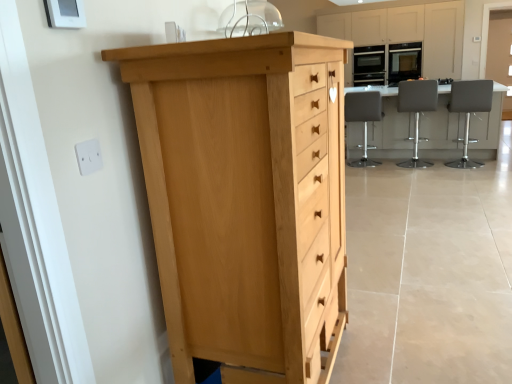
Question: Is white plastic electric outlet at upper left next to leatherette stool at center, marked as the 2th chair in a left-to-right arrangement?

Choices:
 (A) yes
 (B) no

Answer: (B)

Question: Is white plastic electric outlet at upper left surrounding leatherette stool at center, the 2th chair positioned from the right?

Choices:
 (A) no
 (B) yes

Answer: (A)

Question: Is white plastic electric outlet at upper left located outside leatherette stool at center, marked as the 2th chair in a left-to-right arrangement?

Choices:
 (A) yes
 (B) no

Answer: (A)

Question: Considering the relative sizes of white plastic electric outlet at upper left and leatherette stool at center, marked as the 2th chair in a left-to-right arrangement, in the image provided, is white plastic electric outlet at upper left wider than leatherette stool at center, marked as the 2th chair in a left-to-right arrangement,?

Choices:
 (A) no
 (B) yes

Answer: (A)

Question: Is white plastic electric outlet at upper left shorter than leatherette stool at center, marked as the 2th chair in a left-to-right arrangement?

Choices:
 (A) no
 (B) yes

Answer: (B)

Question: Considering the positions of matte light wood cabinets at upper center and transparent glass door at upper right in the image, is matte light wood cabinets at upper center wider or thinner than transparent glass door at upper right?

Choices:
 (A) thin
 (B) wide

Answer: (B)

Question: Considering the relative positions of matte light wood cabinets at upper center and transparent glass door at upper right in the image provided, is matte light wood cabinets at upper center to the left or to the right of transparent glass door at upper right?

Choices:
 (A) left
 (B) right

Answer: (A)

Question: From the image's perspective, is matte light wood cabinets at upper center above or below transparent glass door at upper right?

Choices:
 (A) below
 (B) above

Answer: (A)

Question: In the image, is matte light wood cabinets at upper center positioned in front of or behind transparent glass door at upper right?

Choices:
 (A) front
 (B) behind

Answer: (A)

Question: Is white glossy table at center situated inside gray leather bar stool at right, the first chair from the right, or outside?

Choices:
 (A) inside
 (B) outside

Answer: (B)

Question: From a real-world perspective, is white glossy table at center physically located above or below gray leather bar stool at right, the first chair from the right?

Choices:
 (A) below
 (B) above

Answer: (A)

Question: Is white glossy table at center taller or shorter than gray leather bar stool at right, which is counted as the 3th chair, starting from the left?

Choices:
 (A) short
 (B) tall

Answer: (A)

Question: Is white glossy table at center bigger or smaller than gray leather bar stool at right, which is counted as the 3th chair, starting from the left?

Choices:
 (A) small
 (B) big

Answer: (B)

Question: In terms of width, does matte black oven at upper right, placed as the 1th appliance when sorted from left to right, look wider or thinner when compared to gray leather bar stool at right, which is counted as the 3th chair, starting from the left?

Choices:
 (A) thin
 (B) wide

Answer: (A)

Question: Which is correct: matte black oven at upper right, marked as the second appliance in a right-to-left arrangement, is inside gray leather bar stool at right, which is counted as the 3th chair, starting from the left, or outside of it?

Choices:
 (A) outside
 (B) inside

Answer: (A)